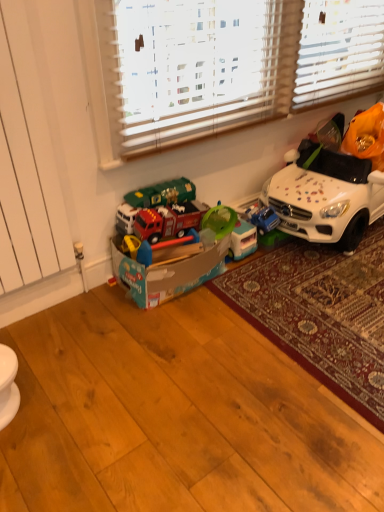
Identify the location of green plastic cup at center, the second toy from the right. This screenshot has width=384, height=512. (232, 230).

Locate an element on the screen. This screenshot has width=384, height=512. red plastic toy truck at center, marked as the 3th toy in a right-to-left arrangement is located at coordinates (178, 249).

Image resolution: width=384 pixels, height=512 pixels. What do you see at coordinates (178, 249) in the screenshot?
I see `red plastic toy truck at center, marked as the 3th toy in a right-to-left arrangement` at bounding box center [178, 249].

Image resolution: width=384 pixels, height=512 pixels. I want to click on blue plastic toy car at center, arranged as the third toy when viewed from the left, so click(261, 220).

What do you see at coordinates (261, 220) in the screenshot? This screenshot has width=384, height=512. I see `blue plastic toy car at center, positioned as the 1th toy in right-to-left order` at bounding box center [261, 220].

Identify the location of white textured blinds at upper center. Image resolution: width=384 pixels, height=512 pixels. (235, 63).

Find the location of a particular element. the 2nd toy counting from the left side of the blue plastic toy car at center, positioned as the 1th toy in right-to-left order is located at coordinates (178, 249).

Is red plastic toy truck at center, marked as the 3th toy in a right-to-left arrangement, touching blue plastic toy car at center, arranged as the third toy when viewed from the left?

No, red plastic toy truck at center, marked as the 3th toy in a right-to-left arrangement, is not with blue plastic toy car at center, arranged as the third toy when viewed from the left.

Considering the relative sizes of red plastic toy truck at center, marked as the 3th toy in a right-to-left arrangement, and blue plastic toy car at center, arranged as the third toy when viewed from the left, in the image provided, is red plastic toy truck at center, marked as the 3th toy in a right-to-left arrangement, taller than blue plastic toy car at center, arranged as the third toy when viewed from the left,?

Correct, red plastic toy truck at center, marked as the 3th toy in a right-to-left arrangement, is much taller as blue plastic toy car at center, arranged as the third toy when viewed from the left.

Between blue plastic toy car at center, positioned as the 1th toy in right-to-left order, and red plastic toy truck at center, marked as the 3th toy in a right-to-left arrangement, which one has smaller size?

Smaller between the two is blue plastic toy car at center, positioned as the 1th toy in right-to-left order.

Consider the image. From the image's perspective, is blue plastic toy car at center, arranged as the third toy when viewed from the left, below red plastic toy truck at center, marked as the 3th toy in a right-to-left arrangement?

Incorrect, from the image's perspective, blue plastic toy car at center, arranged as the third toy when viewed from the left, is higher than red plastic toy truck at center, marked as the 3th toy in a right-to-left arrangement.

Which is in front, blue plastic toy car at center, arranged as the third toy when viewed from the left, or red plastic toy truck at center, which ranks as the first toy in left-to-right order?

red plastic toy truck at center, which ranks as the first toy in left-to-right order, is in front.

Does blue plastic toy car at center, arranged as the third toy when viewed from the left, have a lesser height compared to red plastic toy truck at center, which ranks as the first toy in left-to-right order?

Yes, blue plastic toy car at center, arranged as the third toy when viewed from the left, is shorter than red plastic toy truck at center, which ranks as the first toy in left-to-right order.

Starting from the white textured blinds at upper center, which toy is the 2nd one behind? Please provide its 2D coordinates.

[(261, 220)]

Is blue plastic toy car at center, arranged as the third toy when viewed from the left, facing away from white textured blinds at upper center?

No, white textured blinds at upper center is not at the back of blue plastic toy car at center, arranged as the third toy when viewed from the left.

In the image, is blue plastic toy car at center, positioned as the 1th toy in right-to-left order, on the left side or the right side of white textured blinds at upper center?

In the image, blue plastic toy car at center, positioned as the 1th toy in right-to-left order, appears on the left side of white textured blinds at upper center.

From the image's perspective, is carpeted rug at lower right under blue plastic toy car at center, positioned as the 1th toy in right-to-left order?

Yes, from the image's perspective, carpeted rug at lower right is beneath blue plastic toy car at center, positioned as the 1th toy in right-to-left order.

Does point (305, 362) appear closer or farther from the camera than point (242, 216)?

Clearly, point (305, 362) is closer to the camera than point (242, 216).

Does carpeted rug at lower right appear on the left side of blue plastic toy car at center, arranged as the third toy when viewed from the left?

No.

How different are the orientations of carpeted rug at lower right and blue plastic toy car at center, arranged as the third toy when viewed from the left, in degrees?

They differ by 2.34 degrees in their facing directions.

Starting from the white textured blinds at upper center, which toy is the 3rd one behind? Please provide its 2D coordinates.

[(232, 230)]

Is green plastic cup at center, the second toy from the right, thinner than white textured blinds at upper center?

No, green plastic cup at center, the second toy from the right, is not thinner than white textured blinds at upper center.

Which point is more distant from viewer, (255,230) or (124,9)?

The point (255,230) is farther from the camera.

Would you say green plastic cup at center, the second toy from the right, is to the left or to the right of white textured blinds at upper center in the picture?

green plastic cup at center, the second toy from the right, is positioned on white textured blinds at upper center's left side.

From a real-world perspective, between carpeted rug at lower right and white matte toy car at right, who is vertically lower?

In real-world perspective, carpeted rug at lower right is lower.

How many degrees apart are the facing directions of carpeted rug at lower right and white matte toy car at right?

2.34 degrees separate the facing orientations of carpeted rug at lower right and white matte toy car at right.

Locate an element on the screen. The width and height of the screenshot is (384, 512). car behind the carpeted rug at lower right is located at coordinates (325, 196).

How much distance is there between carpeted rug at lower right and white matte toy car at right?

carpeted rug at lower right is 14.03 inches from white matte toy car at right.

From a real-world perspective, which is physically below, blue plastic toy car at center, positioned as the 1th toy in right-to-left order, or carpeted rug at lower right?

carpeted rug at lower right is physically lower.

Who is bigger, blue plastic toy car at center, arranged as the third toy when viewed from the left, or carpeted rug at lower right?

Bigger between the two is carpeted rug at lower right.

The width and height of the screenshot is (384, 512). I want to click on mat in front of the blue plastic toy car at center, positioned as the 1th toy in right-to-left order, so click(x=321, y=313).

From a real-world perspective, count 1st toys downward from the red plastic toy truck at center, marked as the 3th toy in a right-to-left arrangement, and point to it. Please provide its 2D coordinates.

[(261, 220)]

I want to click on toy above the blue plastic toy car at center, arranged as the third toy when viewed from the left (from a real-world perspective), so click(x=178, y=249).

When comparing their distances from blue plastic toy car at center, positioned as the 1th toy in right-to-left order, does green plastic cup at center, arranged as the 2th toy when viewed from the left, or carpeted rug at lower right seem closer?

Based on the image, green plastic cup at center, arranged as the 2th toy when viewed from the left, appears to be nearer to blue plastic toy car at center, positioned as the 1th toy in right-to-left order.

From the image, which object appears to be farther from carpeted rug at lower right, white matte toy car at right or green plastic cup at center, arranged as the 2th toy when viewed from the left?

Based on the image, green plastic cup at center, arranged as the 2th toy when viewed from the left, appears to be further to carpeted rug at lower right.

Estimate the real-world distances between objects in this image. Which object is further from red plastic toy truck at center, which ranks as the first toy in left-to-right order, green plastic cup at center, arranged as the 2th toy when viewed from the left, or carpeted rug at lower right?

Based on the image, carpeted rug at lower right appears to be further to red plastic toy truck at center, which ranks as the first toy in left-to-right order.

Estimate the real-world distances between objects in this image. Which object is further from carpeted rug at lower right, blue plastic toy car at center, arranged as the third toy when viewed from the left, or white matte toy car at right?

The object further to carpeted rug at lower right is blue plastic toy car at center, arranged as the third toy when viewed from the left.

When comparing their distances from white matte toy car at right, does white textured blinds at upper center or red plastic toy truck at center, marked as the 3th toy in a right-to-left arrangement, seem further?

white textured blinds at upper center.

From the image, which object appears to be farther from carpeted rug at lower right, red plastic toy truck at center, which ranks as the first toy in left-to-right order, or white textured blinds at upper center?

white textured blinds at upper center.

Which object lies nearer to the anchor point green plastic cup at center, the second toy from the right, blue plastic toy car at center, positioned as the 1th toy in right-to-left order, or white matte toy car at right?

blue plastic toy car at center, positioned as the 1th toy in right-to-left order, is positioned closer to the anchor green plastic cup at center, the second toy from the right.

When comparing their distances from white textured blinds at upper center, does red plastic toy truck at center, marked as the 3th toy in a right-to-left arrangement, or carpeted rug at lower right seem closer?

red plastic toy truck at center, marked as the 3th toy in a right-to-left arrangement, lies closer to white textured blinds at upper center than the other object.

Locate an element on the screen. This screenshot has width=384, height=512. toy located between green plastic cup at center, arranged as the 2th toy when viewed from the left, and white matte toy car at right in the left-right direction is located at coordinates [261, 220].

Identify the location of car between white textured blinds at upper center and carpeted rug at lower right in the vertical direction. This screenshot has height=512, width=384. (325, 196).

What are the coordinates of `toy between red plastic toy truck at center, which ranks as the first toy in left-to-right order, and green plastic cup at center, the second toy from the right, in the front-back direction` in the screenshot? It's located at (261, 220).

Locate an element on the screen. blind between red plastic toy truck at center, marked as the 3th toy in a right-to-left arrangement, and white matte toy car at right from left to right is located at coordinates (235, 63).